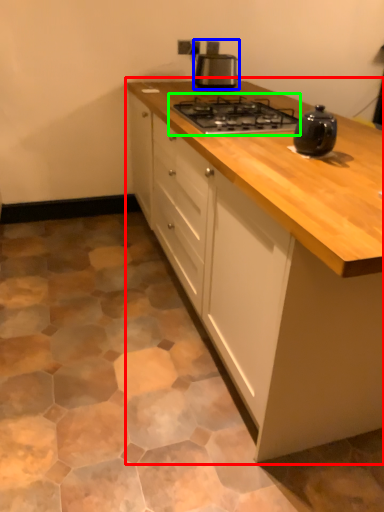
Question: Which object is the farthest from cabinetry (highlighted by a red box)? Choose among these: kitchen appliance (highlighted by a blue box) or gas stove (highlighted by a green box).

Choices:
 (A) kitchen appliance
 (B) gas stove

Answer: (A)